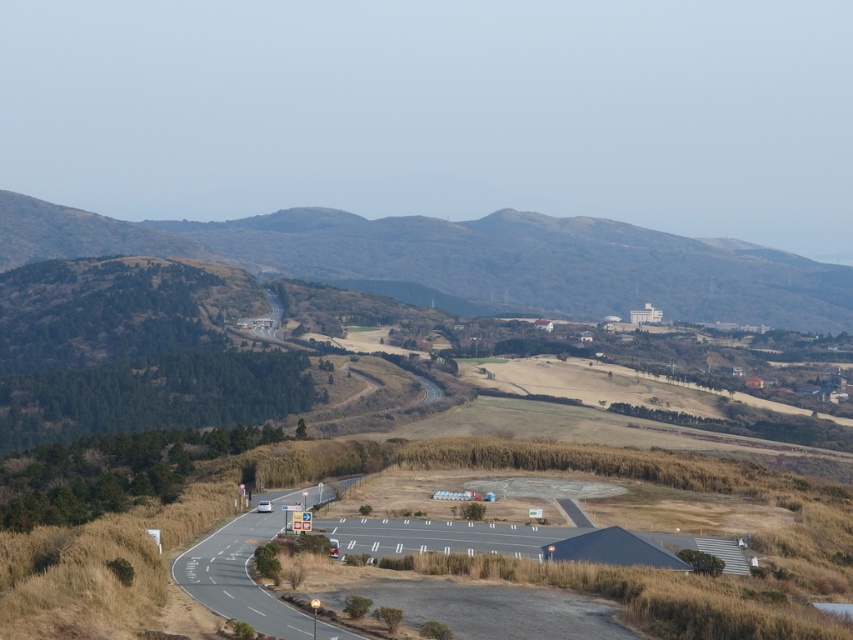
Question: Considering the real-world distances, which object is closest to the brown textured hillside at upper center?

Choices:
 (A) white asphalt highway at lower left
 (B) asphalt road at lower center

Answer: (A)

Question: Can you confirm if brown textured hillside at upper center is bigger than asphalt road at lower center?

Choices:
 (A) yes
 (B) no

Answer: (A)

Question: Does brown textured hillside at upper center have a smaller size compared to white asphalt highway at lower left?

Choices:
 (A) no
 (B) yes

Answer: (A)

Question: Is asphalt road at lower center in front of white asphalt highway at lower left?

Choices:
 (A) no
 (B) yes

Answer: (B)

Question: Which of these objects is positioned closest to the brown textured hillside at upper center?

Choices:
 (A) asphalt road at lower center
 (B) white asphalt highway at lower left

Answer: (B)

Question: Which point appears closest to the camera in this image?

Choices:
 (A) (x=833, y=298)
 (B) (x=178, y=577)
 (C) (x=219, y=580)

Answer: (C)